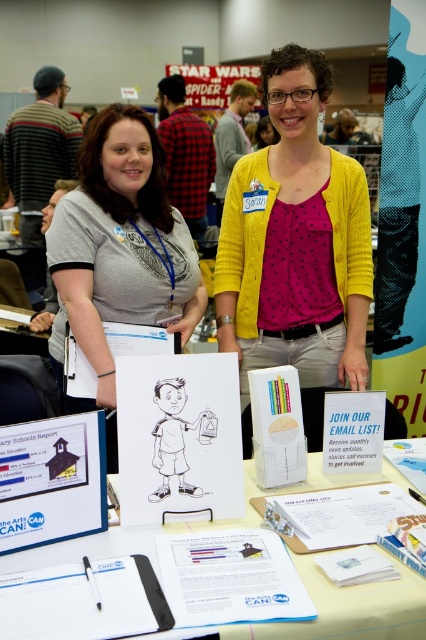
What do you see at coordinates (348, 609) in the screenshot? I see `white paper at center` at bounding box center [348, 609].

Find the location of a particular element. white paper at center is located at coordinates (348, 609).

Is gray cotton t-shirt at center below black matte folder at lower left?

No, gray cotton t-shirt at center is not below black matte folder at lower left.

Which is in front, point (170, 326) or point (155, 625)?

Positioned in front is point (155, 625).

Where is `gray cotton t-shirt at center`? The width and height of the screenshot is (426, 640). gray cotton t-shirt at center is located at coordinates (120, 244).

Is gray cotton t-shirt at center to the left of white paper at center from the viewer's perspective?

Yes, gray cotton t-shirt at center is to the left of white paper at center.

Which of these two, gray cotton t-shirt at center or white paper at center, stands shorter?

white paper at center is shorter.

Where is `gray cotton t-shirt at center`? This screenshot has height=640, width=426. gray cotton t-shirt at center is located at coordinates (120, 244).

Image resolution: width=426 pixels, height=640 pixels. Identify the location of gray cotton t-shirt at center. (120, 244).